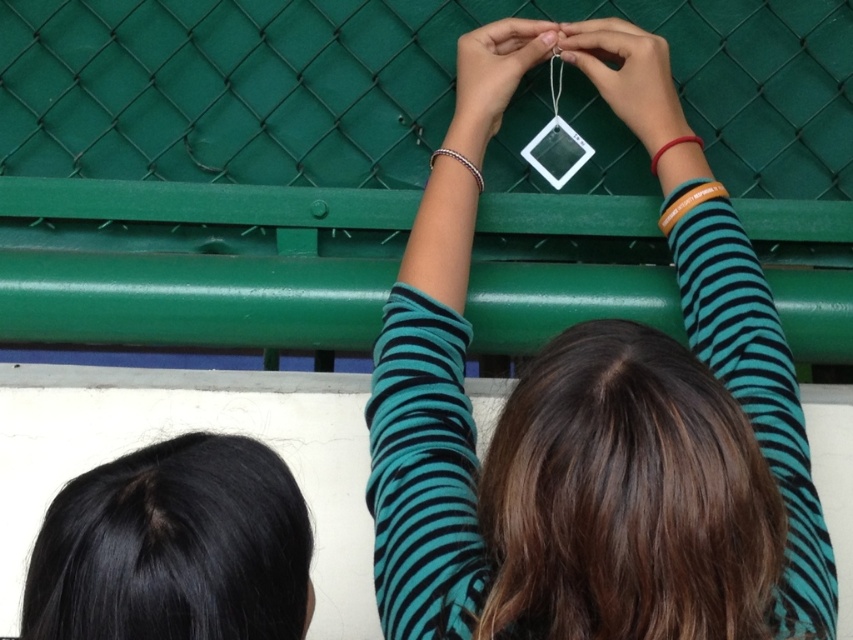
You are standing in front of the two people in the image. Where is the green matte fence at center located?

The green matte fence at center is located at point (352, 157).